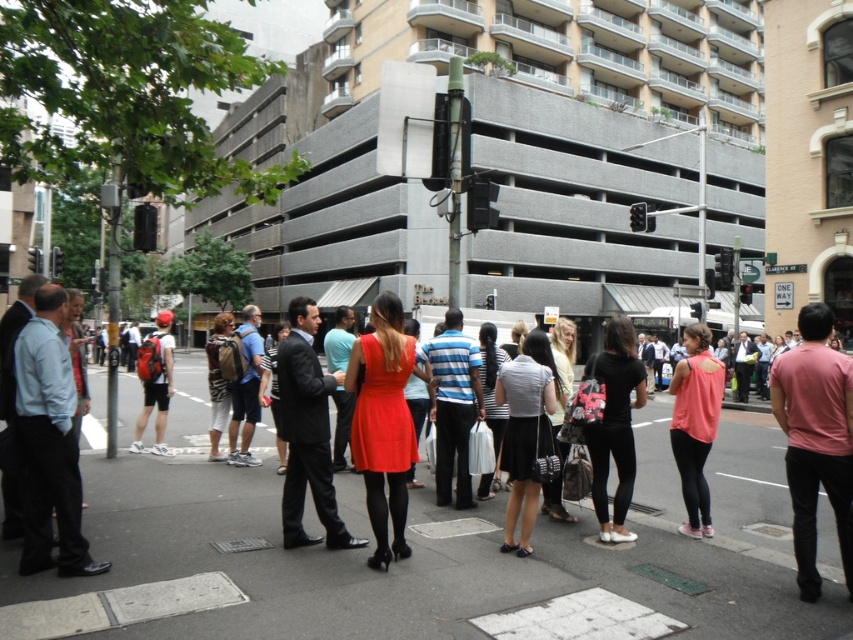
Is point (527, 397) behind point (605, 374)?

No.

Who is more forward, (509, 432) or (610, 376)?

Point (509, 432)

Locate an element on the screen. The image size is (853, 640). matte black dress at center is located at coordinates (525, 432).

Identify the location of pink matte shirt at right. (815, 440).

In order to click on pink matte shirt at right in this screenshot , I will do `click(815, 440)`.

Does matte red dress at center have a smaller size compared to matte black dress at center?

No.

Which is in front, point (386, 300) or point (532, 509)?

Positioned in front is point (386, 300).

Does point (390, 461) come closer to viewer compared to point (541, 397)?

Yes.

Where is `matte red dress at center`? Image resolution: width=853 pixels, height=640 pixels. matte red dress at center is located at coordinates (383, 422).